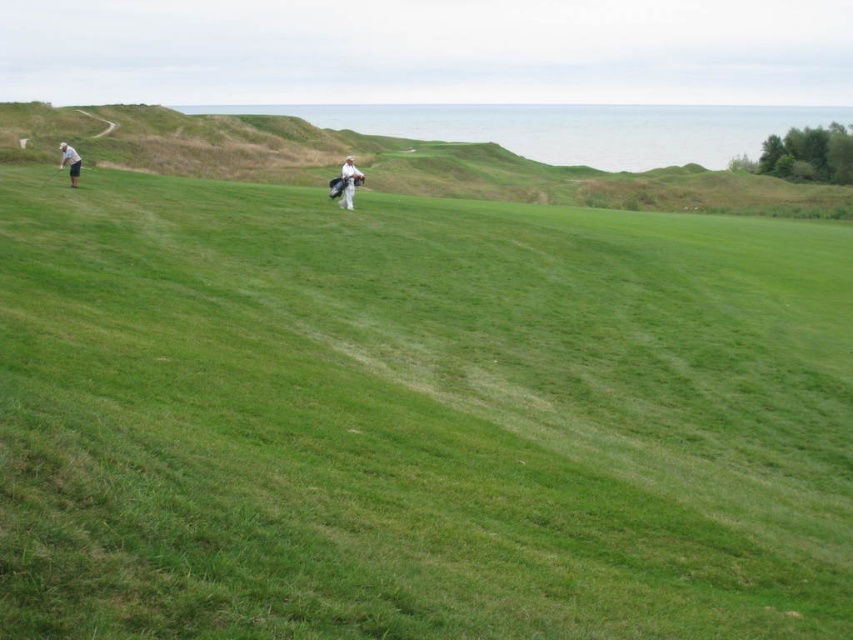
Who is positioned more to the left, green grassy at center or white matte golf club at left?

white matte golf club at left

Based on the photo, is green grassy at center to the left of white matte golf club at left from the viewer's perspective?

In fact, green grassy at center is to the right of white matte golf club at left.

Identify the location of green grassy at center. (416, 419).

What are the coordinates of `green grassy at center` in the screenshot? It's located at (416, 419).

Does green grassy at center have a larger size compared to white matte golf bag at center?

Correct, green grassy at center is larger in size than white matte golf bag at center.

What do you see at coordinates (416, 419) in the screenshot? I see `green grassy at center` at bounding box center [416, 419].

Where is `green grassy at center`? green grassy at center is located at coordinates (416, 419).

Can you confirm if green grassy at center is positioned to the right of green grassy hillside at upper left?

Indeed, green grassy at center is positioned on the right side of green grassy hillside at upper left.

Can you confirm if green grassy at center is positioned to the left of green grassy hillside at upper left?

In fact, green grassy at center is to the right of green grassy hillside at upper left.

Describe the element at coordinates (416, 419) in the screenshot. This screenshot has width=853, height=640. I see `green grassy at center` at that location.

Find the location of `green grassy at center`. green grassy at center is located at coordinates click(x=416, y=419).